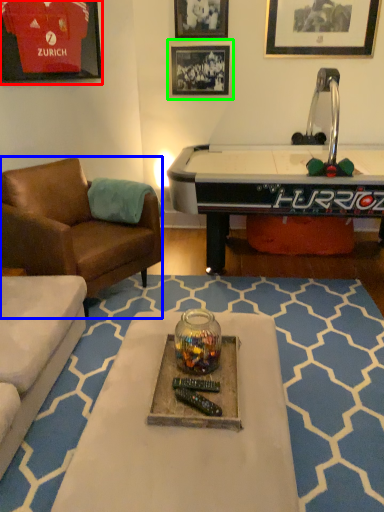
Question: Which object is positioned farthest from picture frame (highlighted by a red box)? Select from chair (highlighted by a blue box) and picture frame (highlighted by a green box).

Choices:
 (A) chair
 (B) picture frame

Answer: (B)